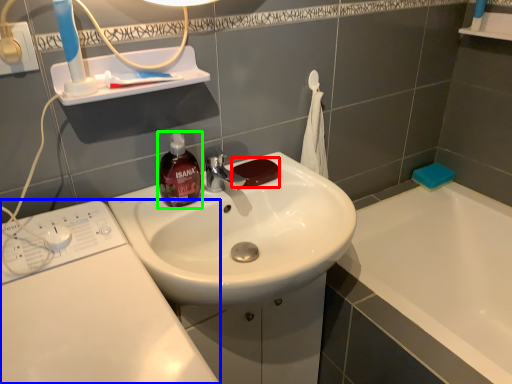
Question: Based on their relative distances, which object is farther from soap (highlighted by a red box)? Choose from washing machine (highlighted by a blue box) and soap dispenser (highlighted by a green box).

Choices:
 (A) washing machine
 (B) soap dispenser

Answer: (A)